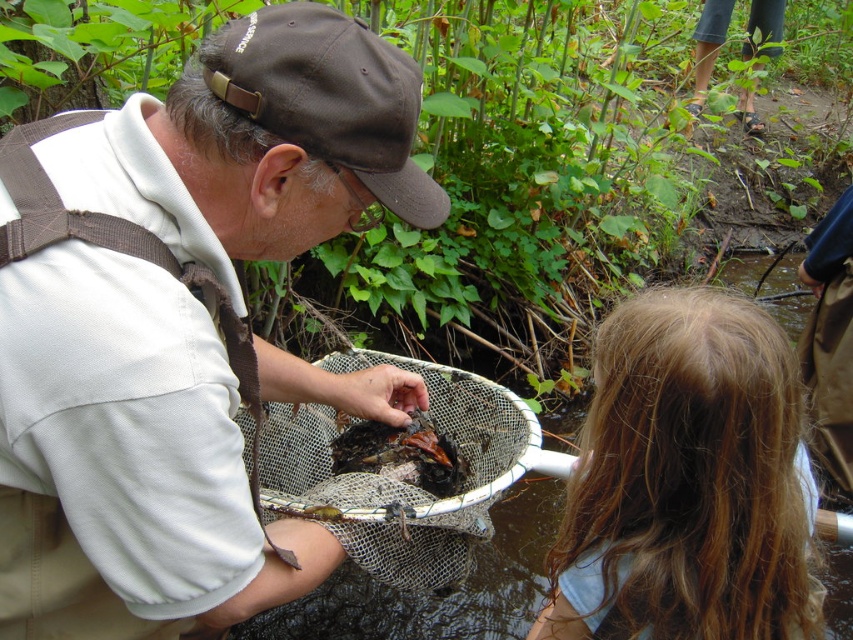
Question: Can you confirm if blonde hair at upper right is positioned below shiny brown crab at center?

Choices:
 (A) yes
 (B) no

Answer: (A)

Question: Is blonde hair at upper right to the left of brown fabric cap at upper center from the viewer's perspective?

Choices:
 (A) no
 (B) yes

Answer: (A)

Question: Which object is positioned farthest from the brown fabric cap at upper center?

Choices:
 (A) brown fabric hat at upper center
 (B) shiny brown crab at center
 (C) blonde hair at upper right

Answer: (B)

Question: Can you confirm if brown fabric hat at upper center is positioned below blonde hair at upper right?

Choices:
 (A) no
 (B) yes

Answer: (A)

Question: Which point appears closest to the camera in this image?

Choices:
 (A) (792, 602)
 (B) (422, 467)
 (C) (395, 77)
 (D) (247, 157)

Answer: (D)

Question: Which object appears farthest from the camera in this image?

Choices:
 (A) brown fabric cap at upper center
 (B) blonde hair at upper right
 (C) brown fabric hat at upper center
 (D) shiny brown crab at center

Answer: (D)